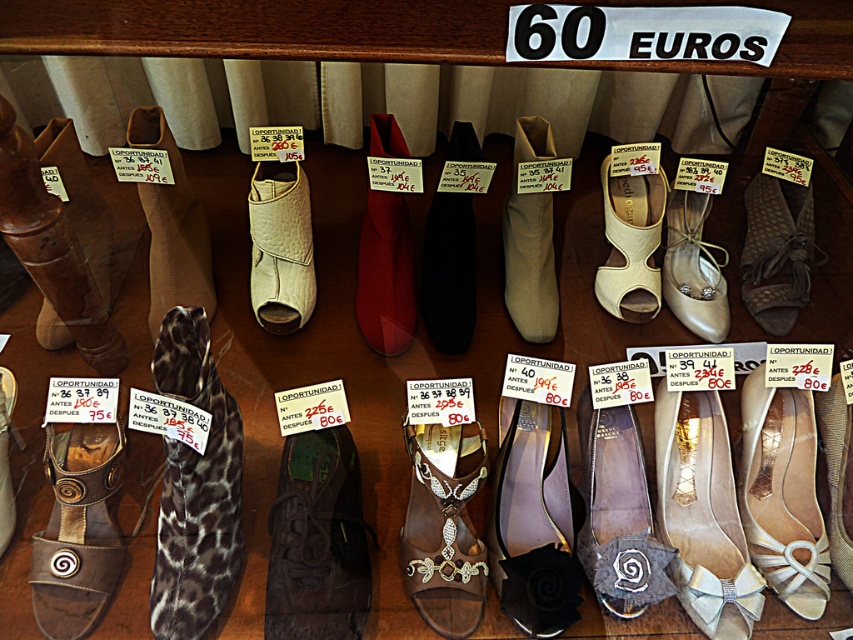
You are a customer looking to purchase the black leather sandal at center and the satin beige flat at center right. You want to know which shoe is closer to you so you can reach it first. Which shoe is closer to you?

The satin beige flat at center right is closer to you because the black leather sandal at center is behind it.